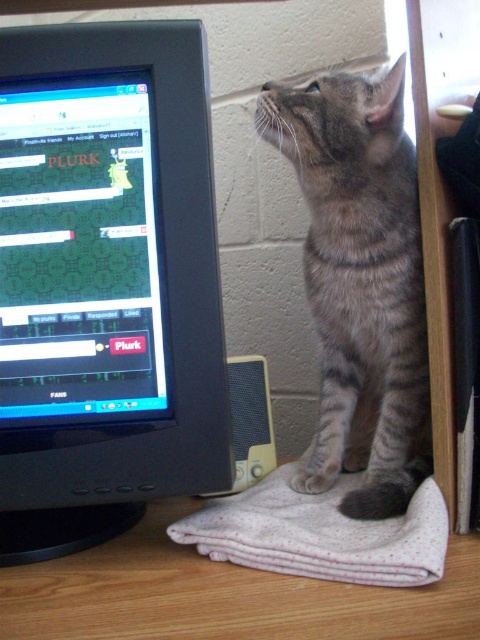
Question: Does black plastic monitor at left appear over matte black monitor at center?

Choices:
 (A) no
 (B) yes

Answer: (A)

Question: Which of the following is the closest to the observer?

Choices:
 (A) black plastic monitor at left
 (B) matte black monitor at center

Answer: (A)

Question: Which point appears closest to the camera in this image?

Choices:
 (A) (33, 388)
 (B) (349, 122)

Answer: (A)

Question: In this image, where is black plastic monitor at left located relative to white textured cloth at lower center?

Choices:
 (A) below
 (B) above

Answer: (B)

Question: In this image, where is matte black monitor at center located relative to white textured cloth at lower center?

Choices:
 (A) left
 (B) right

Answer: (A)

Question: Which point is farther to the camera?

Choices:
 (A) white textured cloth at lower center
 (B) matte black monitor at center
 (C) gray striped cat at upper right

Answer: (C)